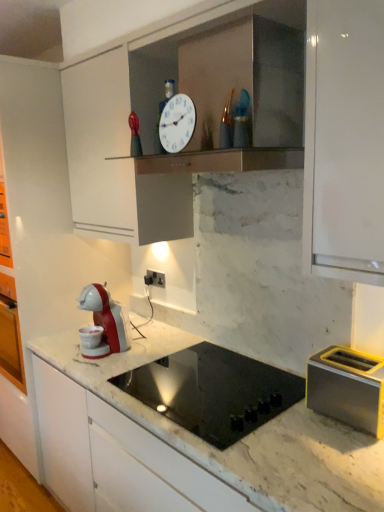
Question: Is black glass cooktop at center outside of white glossy clock at upper center?

Choices:
 (A) yes
 (B) no

Answer: (A)

Question: Considering the relative sizes of black glass cooktop at center and white glossy clock at upper center in the image provided, is black glass cooktop at center shorter than white glossy clock at upper center?

Choices:
 (A) no
 (B) yes

Answer: (B)

Question: Can you confirm if black glass cooktop at center is taller than white glossy clock at upper center?

Choices:
 (A) no
 (B) yes

Answer: (A)

Question: Does black glass cooktop at center appear on the right side of white glossy clock at upper center?

Choices:
 (A) yes
 (B) no

Answer: (A)

Question: Is black glass cooktop at center not close to white glossy clock at upper center?

Choices:
 (A) yes
 (B) no

Answer: (B)

Question: Is black glass cooktop at center behind white glossy clock at upper center?

Choices:
 (A) no
 (B) yes

Answer: (A)

Question: Does black plastic electric outlet at center have a lesser width compared to metallic yellow toaster at right?

Choices:
 (A) yes
 (B) no

Answer: (A)

Question: From a real-world perspective, is black plastic electric outlet at center located beneath metallic yellow toaster at right?

Choices:
 (A) yes
 (B) no

Answer: (B)

Question: Is metallic yellow toaster at right completely or partially inside black plastic electric outlet at center?

Choices:
 (A) no
 (B) yes

Answer: (A)

Question: From a real-world perspective, is black plastic electric outlet at center physically above metallic yellow toaster at right?

Choices:
 (A) yes
 (B) no

Answer: (A)

Question: Is black plastic electric outlet at center in front of metallic yellow toaster at right?

Choices:
 (A) yes
 (B) no

Answer: (B)

Question: Is black plastic electric outlet at center taller than metallic yellow toaster at right?

Choices:
 (A) yes
 (B) no

Answer: (B)

Question: Can you confirm if black plastic electric outlet at center is shorter than black glass cooktop at center?

Choices:
 (A) yes
 (B) no

Answer: (A)